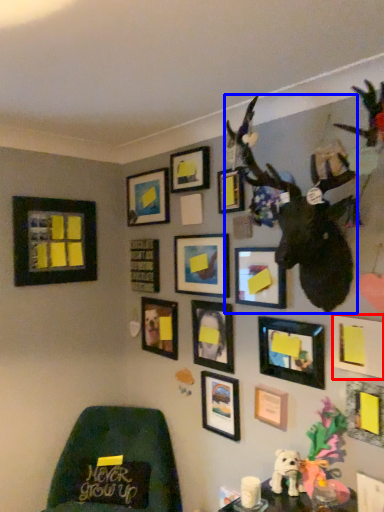
Question: Among these objects, which one is nearest to the camera, picture frame (highlighted by a red box) or animal (highlighted by a blue box)?

Choices:
 (A) picture frame
 (B) animal

Answer: (B)